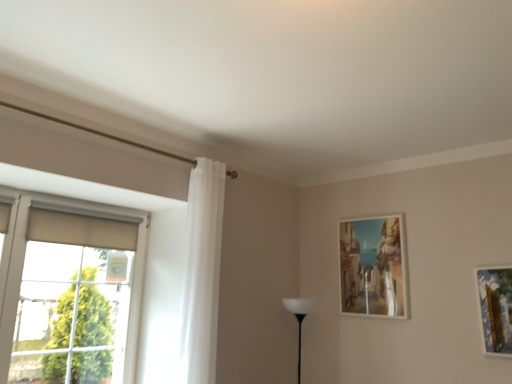
Question: Is matte wooden picture frame at upper right further to camera compared to white sheer curtain at left?

Choices:
 (A) yes
 (B) no

Answer: (A)

Question: From a real-world perspective, is matte wooden picture frame at upper right physically above white sheer curtain at left?

Choices:
 (A) no
 (B) yes

Answer: (B)

Question: Does matte wooden picture frame at upper right have a greater height compared to white sheer curtain at left?

Choices:
 (A) yes
 (B) no

Answer: (B)

Question: Can you confirm if matte wooden picture frame at upper right is positioned to the left of white sheer curtain at left?

Choices:
 (A) yes
 (B) no

Answer: (B)

Question: Does matte wooden picture frame at upper right appear on the right side of white sheer curtain at left?

Choices:
 (A) yes
 (B) no

Answer: (A)

Question: From their relative heights in the image, would you say white matte table lamp at center is taller or shorter than white sheer curtain at left?

Choices:
 (A) tall
 (B) short

Answer: (B)

Question: In terms of width, does white matte table lamp at center look wider or thinner when compared to white sheer curtain at left?

Choices:
 (A) thin
 (B) wide

Answer: (A)

Question: Relative to white sheer curtain at left, is white matte table lamp at center in front or behind?

Choices:
 (A) front
 (B) behind

Answer: (B)

Question: From a real-world perspective, is white matte table lamp at center positioned above or below white sheer curtain at left?

Choices:
 (A) above
 (B) below

Answer: (B)

Question: In terms of size, does white matte table lamp at center appear bigger or smaller than matte wooden picture frame at upper right?

Choices:
 (A) small
 (B) big

Answer: (B)

Question: Is white matte table lamp at center to the left or to the right of matte wooden picture frame at upper right in the image?

Choices:
 (A) right
 (B) left

Answer: (B)

Question: From the image's perspective, is white matte table lamp at center positioned above or below matte wooden picture frame at upper right?

Choices:
 (A) above
 (B) below

Answer: (B)

Question: From their relative heights in the image, would you say white matte table lamp at center is taller or shorter than matte wooden picture frame at upper right?

Choices:
 (A) tall
 (B) short

Answer: (B)

Question: Would you say matte beige roller blind at left is to the left or to the right of matte wooden picture frame at upper right in the picture?

Choices:
 (A) left
 (B) right

Answer: (A)

Question: In terms of size, does matte beige roller blind at left appear bigger or smaller than matte wooden picture frame at upper right?

Choices:
 (A) big
 (B) small

Answer: (A)